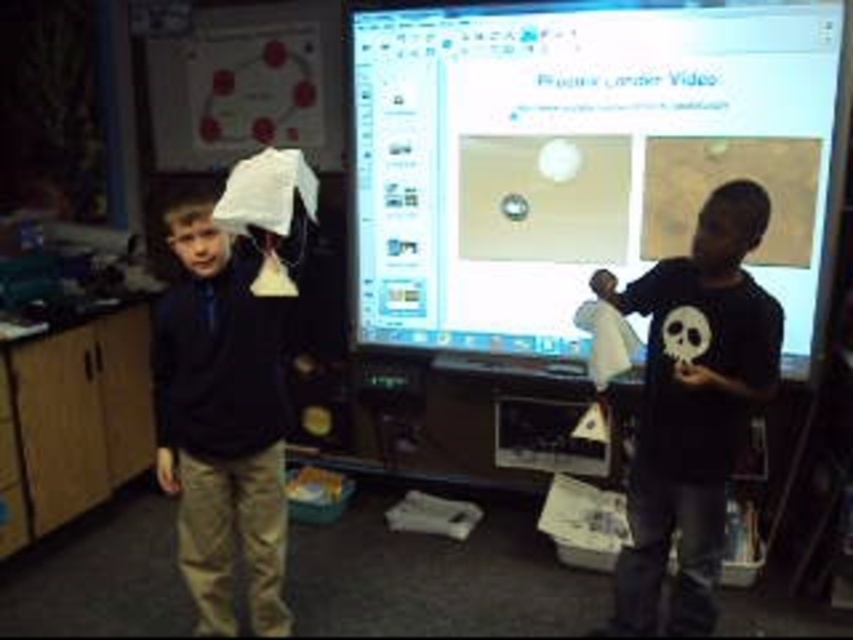
Question: Considering the relative positions of white glossy monitor at center and black matte shirt at right in the image provided, where is white glossy monitor at center located with respect to black matte shirt at right?

Choices:
 (A) below
 (B) above

Answer: (B)

Question: Is white glossy monitor at center wider than matte black jacket at left?

Choices:
 (A) no
 (B) yes

Answer: (B)

Question: Estimate the real-world distances between objects in this image. Which object is farther from the black matte shirt at right?

Choices:
 (A) matte black jacket at left
 (B) white glossy monitor at center

Answer: (A)

Question: Which object is positioned closest to the matte black jacket at left?

Choices:
 (A) white glossy monitor at center
 (B) black matte shirt at right

Answer: (B)

Question: Which point is farther to the camera?

Choices:
 (A) click(180, 406)
 (B) click(659, 596)

Answer: (B)

Question: Does white glossy monitor at center appear over matte black jacket at left?

Choices:
 (A) yes
 (B) no

Answer: (A)